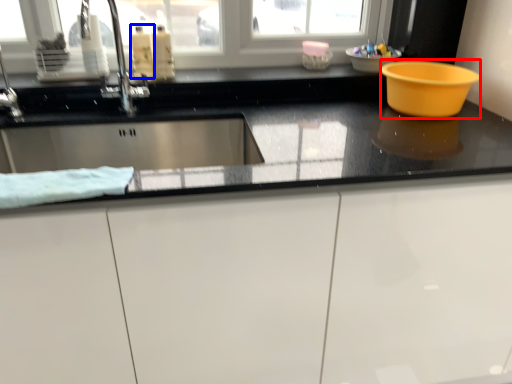
Question: Which point is closer to the camera, basin (highlighted by a red box) or liquid (highlighted by a blue box)?

Choices:
 (A) basin
 (B) liquid

Answer: (A)